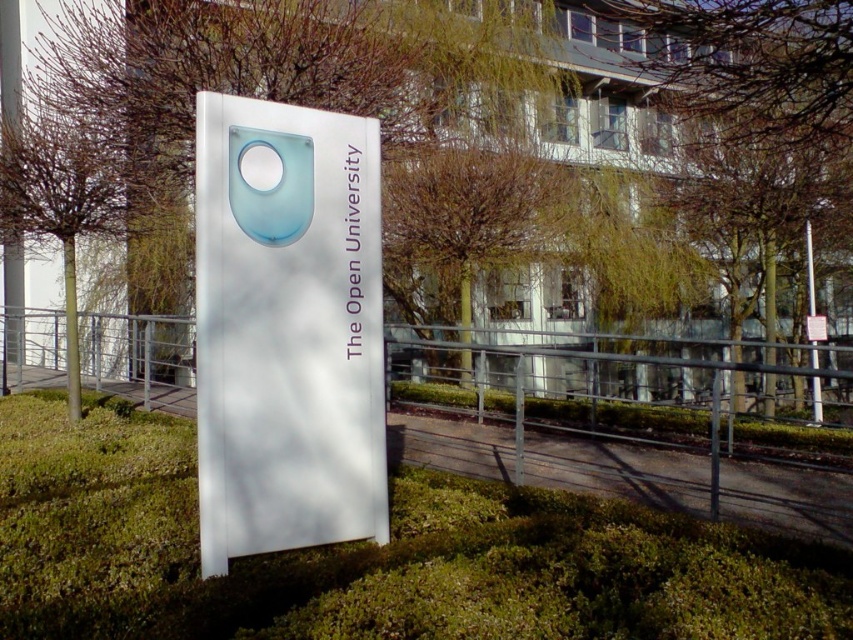
Between green grass at center and translucent blue circle at center, which one has less height?

green grass at center

Locate an element on the screen. Image resolution: width=853 pixels, height=640 pixels. green grass at center is located at coordinates (370, 556).

Is point (93, 628) behind point (305, 323)?

No.

Between point (604, 509) and point (258, 193), which one is positioned in front?

Point (258, 193) is in front.

At what (x,y) coordinates should I click in order to perform the action: click on green grass at center. Please return your answer as a coordinate pair (x, y). The width and height of the screenshot is (853, 640). Looking at the image, I should click on (370, 556).

Is white glossy sign at center to the right of translucent blue circle at center from the viewer's perspective?

Yes, white glossy sign at center is to the right of translucent blue circle at center.

Does white glossy sign at center have a greater width compared to translucent blue circle at center?

Yes.

Is point (270, 104) closer to camera compared to point (299, 193)?

Yes, it is in front of point (299, 193).

The height and width of the screenshot is (640, 853). What are the coordinates of `white glossy sign at center` in the screenshot? It's located at (287, 328).